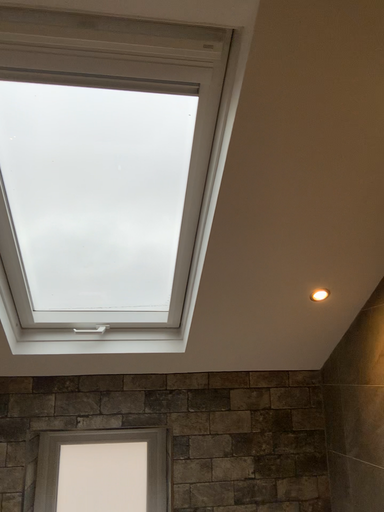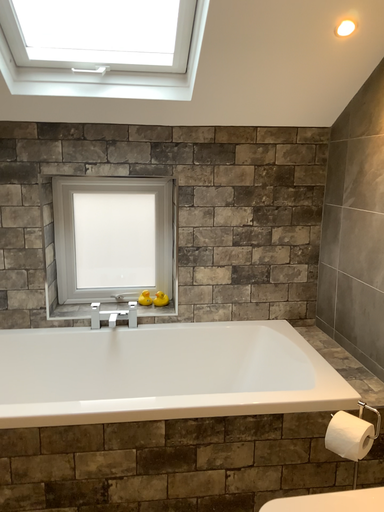
Question: How did the camera likely rotate when shooting the video?

Choices:
 (A) rotated downward
 (B) rotated upward

Answer: (A)